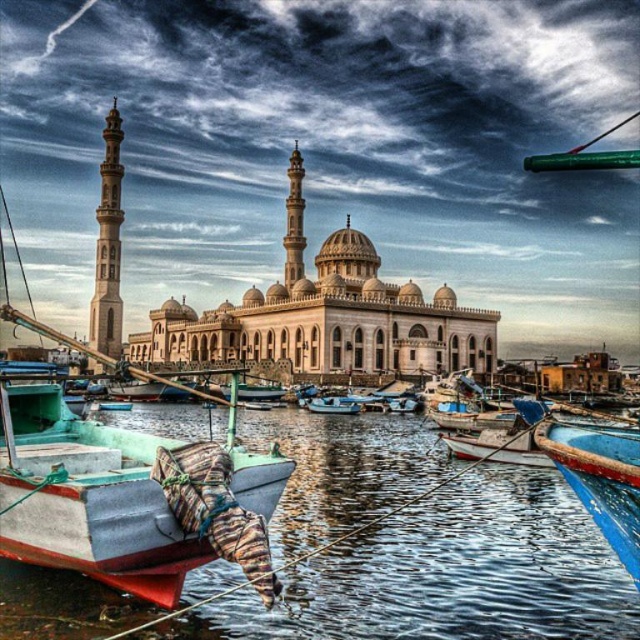
Question: Does teal matte boat at center appear under beige stone mosque at center?

Choices:
 (A) yes
 (B) no

Answer: (A)

Question: Is teal matte boat at center below green plastic boat at center?

Choices:
 (A) yes
 (B) no

Answer: (B)

Question: Which object is farther from the camera taking this photo?

Choices:
 (A) smooth water at lower center
 (B) teal matte boat at center

Answer: (A)

Question: Does teal matte boat at center have a larger size compared to blue plastic boat at center?

Choices:
 (A) no
 (B) yes

Answer: (B)

Question: Which point is closer to the camera?

Choices:
 (A) (129, 620)
 (B) (627, 500)

Answer: (B)

Question: Which of these objects is positioned farthest from the beige stone mosque at center?

Choices:
 (A) blue plastic boat at center
 (B) green plastic boat at center

Answer: (B)